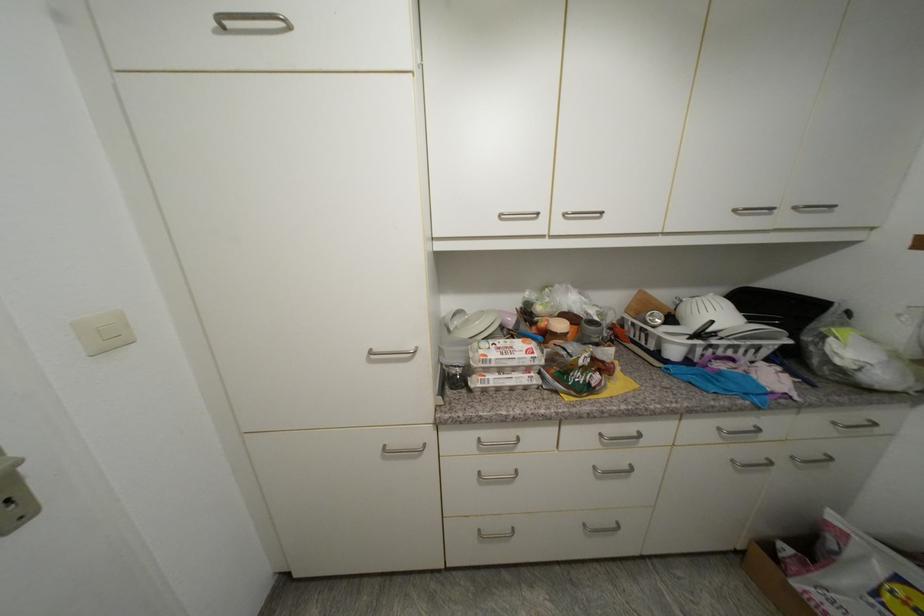
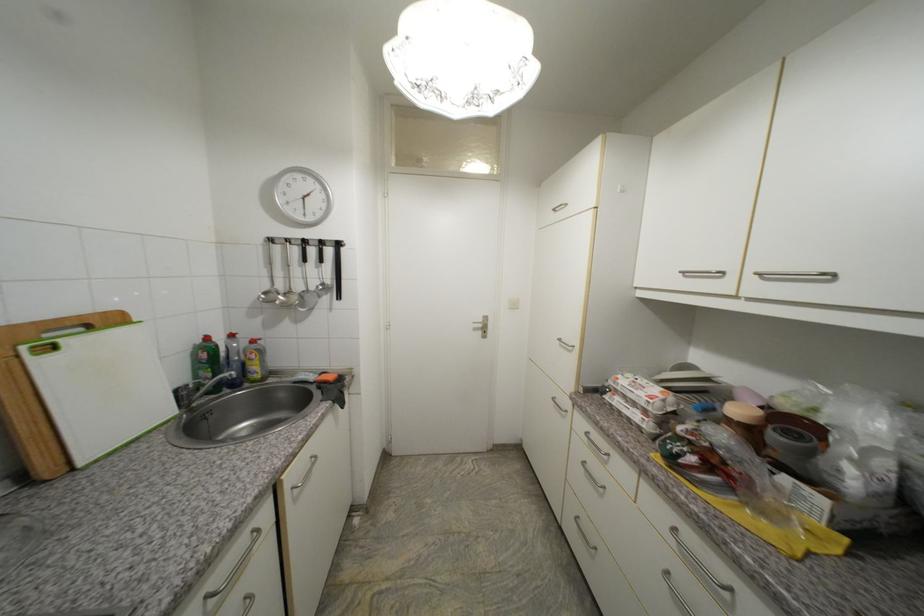
Question: The images are taken continuously from a first-person perspective. In which direction is your viewpoint rotating?

Choices:
 (A) Left
 (B) Right
 (C) Up
 (D) Down

Answer: (A)